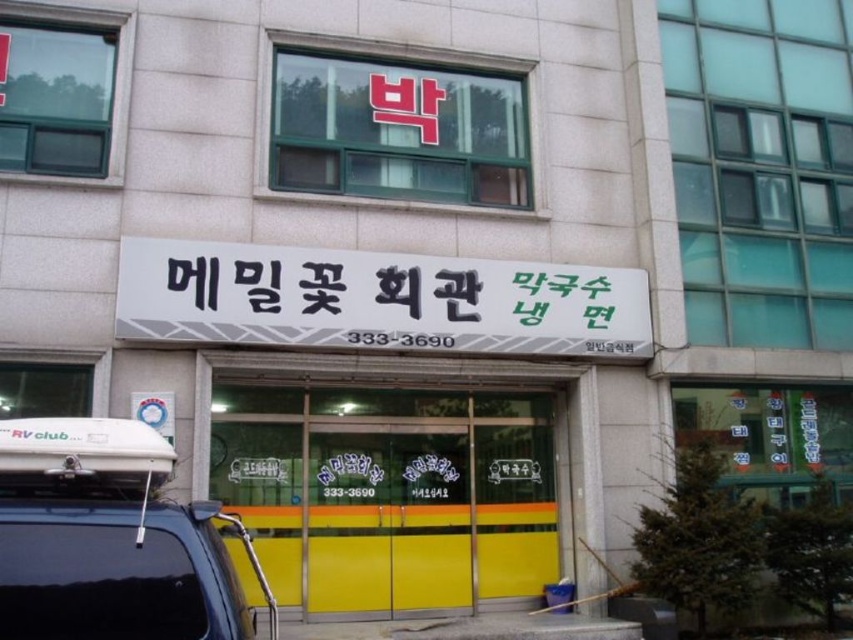
Question: Estimate the real-world distances between objects in this image. Which object is closer to the black plastic signboard at center?

Choices:
 (A) black matte suv at lower left
 (B) yellow matte door at center

Answer: (B)

Question: Is yellow matte door at center to the right of black matte suv at lower left from the viewer's perspective?

Choices:
 (A) no
 (B) yes

Answer: (B)

Question: In this image, where is yellow matte door at center located relative to black matte suv at lower left?

Choices:
 (A) right
 (B) left

Answer: (A)

Question: Among these objects, which one is nearest to the camera?

Choices:
 (A) black matte suv at lower left
 (B) black plastic signboard at center
 (C) yellow matte door at center

Answer: (A)

Question: Which object is positioned closest to the black plastic signboard at center?

Choices:
 (A) yellow matte door at center
 (B) black matte suv at lower left

Answer: (A)

Question: Is yellow matte door at center thinner than black plastic signboard at center?

Choices:
 (A) no
 (B) yes

Answer: (B)